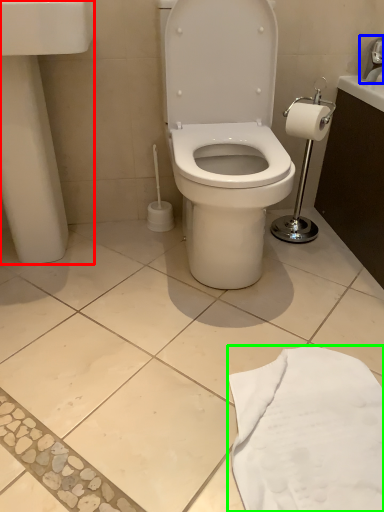
Question: Which is farther away from porcelain (highlighted by a red box)? faucet (highlighted by a blue box) or cloth (highlighted by a green box)?

Choices:
 (A) faucet
 (B) cloth

Answer: (A)